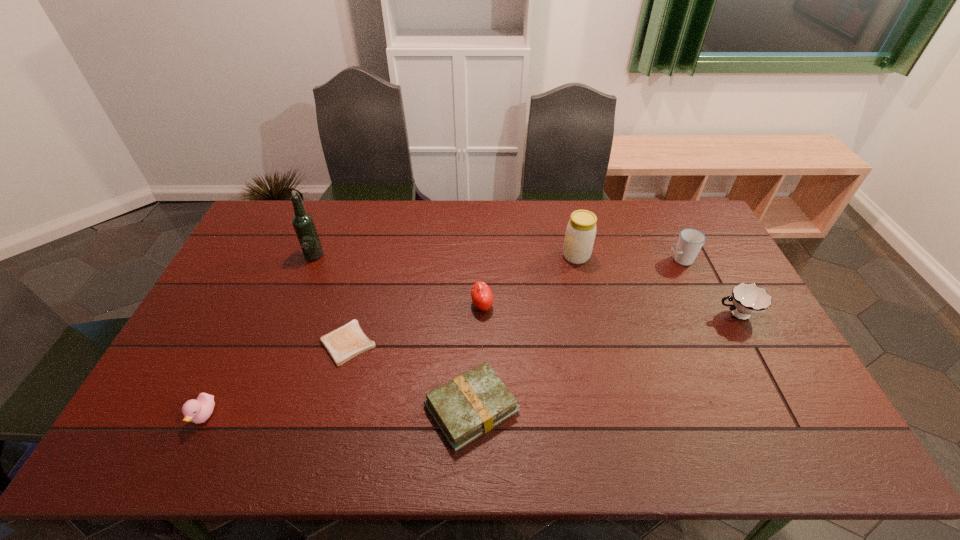
The height and width of the screenshot is (540, 960). Identify the location of toast. (344, 343).

Identify the location of the shortest object. This screenshot has height=540, width=960. (344, 343).

At what (x,y) coordinates should I click in order to perform the action: click on free space located 0.330m on the front of the beer bottle. Please return your answer as a coordinate pair (x, y). Image resolution: width=960 pixels, height=540 pixels. Looking at the image, I should click on (280, 340).

This screenshot has height=540, width=960. Identify the location of vacant space located on the back of the jar. (570, 228).

The image size is (960, 540). I want to click on vacant space located 0.100m with a handle on the side of the farther cup, so click(x=637, y=260).

This screenshot has height=540, width=960. I want to click on free space located with a handle on the side of the farther cup, so click(582, 260).

At what (x,y) coordinates should I click in order to perform the action: click on vacant area located with a handle on the side of the farther cup. Please return your answer as a coordinate pair (x, y). The width and height of the screenshot is (960, 540). Looking at the image, I should click on (637, 260).

Where is `blank space located on the back of the apple`? Image resolution: width=960 pixels, height=540 pixels. blank space located on the back of the apple is located at coordinates [482, 284].

Identify the location of vacant space located on the side of the shorter cup with the handle. Image resolution: width=960 pixels, height=540 pixels. (588, 314).

In order to click on vacant space located on the side of the shorter cup with the handle in this screenshot , I will do `click(628, 314)`.